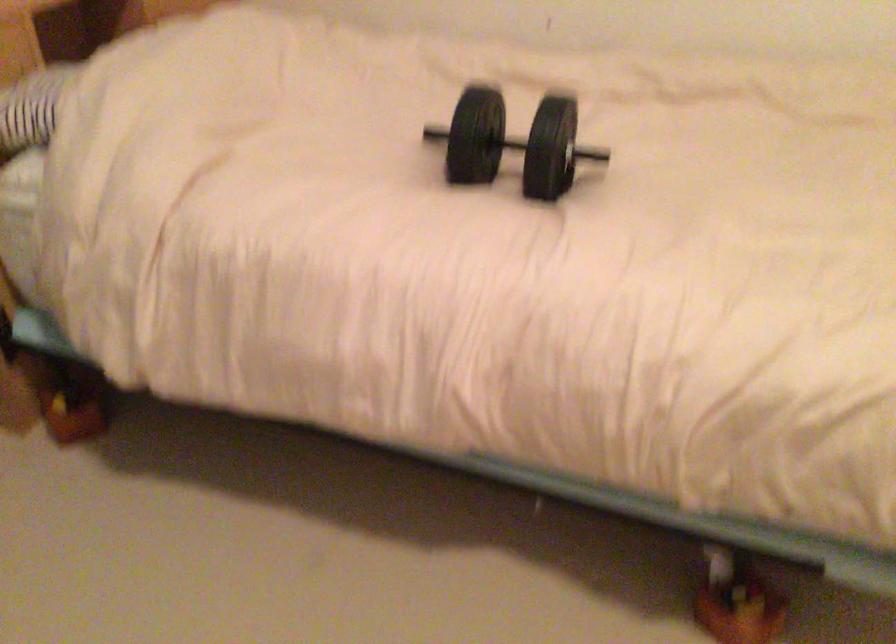
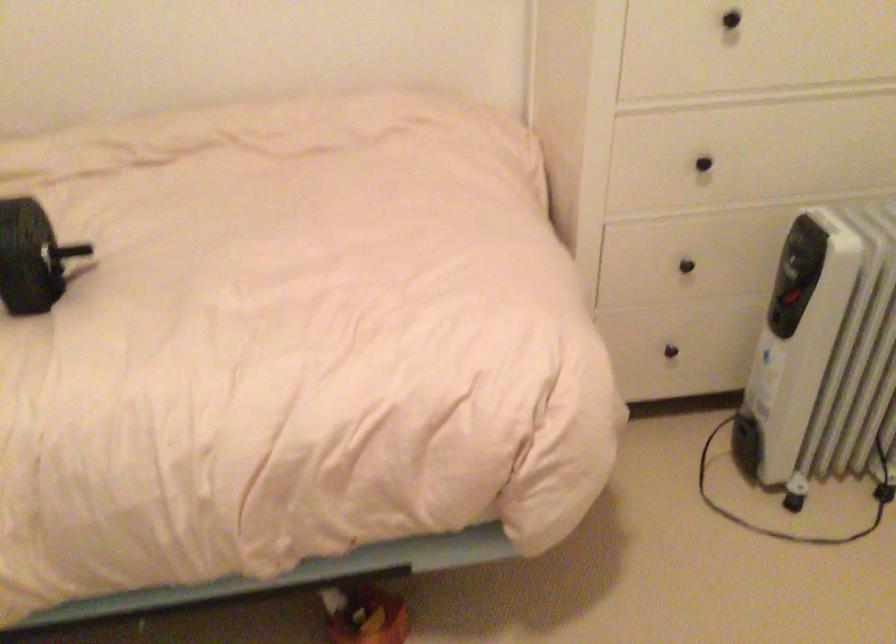
Where in the second image is the point corresponding to (x=556, y=154) from the first image?

(30, 257)